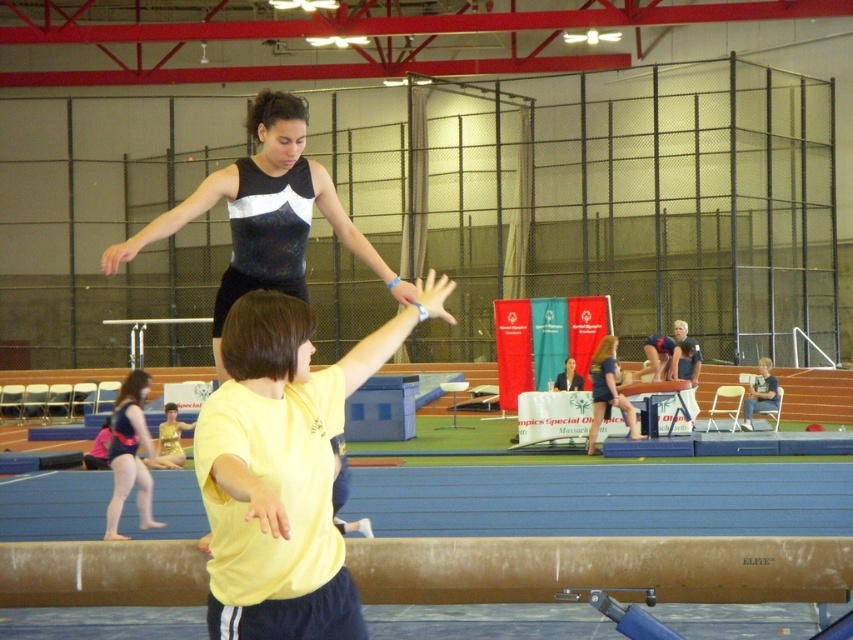
Question: Considering the relative positions of yellow matte shirt at center and brown wooden balance beam at center in the image provided, where is yellow matte shirt at center located with respect to brown wooden balance beam at center?

Choices:
 (A) right
 (B) left

Answer: (B)

Question: Considering the relative positions of matte blue shorts at center and matte black leotard at center in the image provided, where is matte blue shorts at center located with respect to matte black leotard at center?

Choices:
 (A) below
 (B) above

Answer: (B)

Question: Based on their relative distances, which object is farther from the light blue denim shorts at lower right?

Choices:
 (A) matte blue shorts at center
 (B) brown wooden balance beam at center
 (C) sparkly black leotard at upper center

Answer: (B)

Question: Does brown wooden balance beam at center appear on the right side of matte black leotard at lower left?

Choices:
 (A) yes
 (B) no

Answer: (A)

Question: Among these points, which one is farthest from the camera?

Choices:
 (A) (605, 394)
 (B) (149, 476)
 (C) (619, 536)

Answer: (A)

Question: Which object appears closest to the camera in this image?

Choices:
 (A) matte blue shorts at center
 (B) sparkly black leotard at upper center
 (C) light blue denim shorts at lower right

Answer: (B)